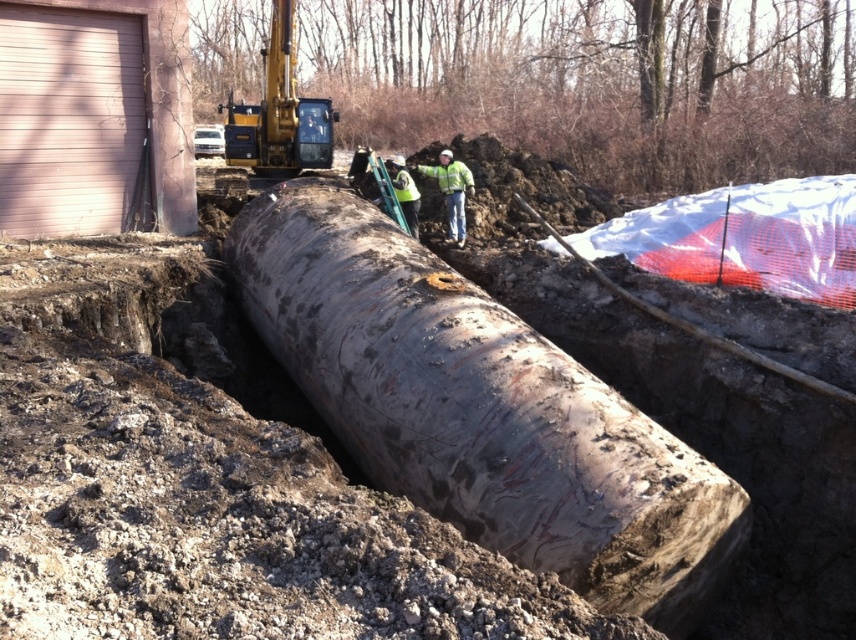
You are a construction inspector who needs to assess the installation of the rusty metallic water pipe at center. The high visibility yellow jacket at center is worn by a worker nearby. Since the jacket is meant to be seen from a distance, could the size of the jacket be an issue when viewed from the excavator parked at the edge of the trench?

The rusty metallic water pipe at center has a larger size compared to the high visibility yellow jacket at center. Since the jacket is smaller, it might be harder to see from a distance, potentially making the worker less visible to someone operating the excavator at the edge of the trench.

You are a safety inspector at the construction site. You need to check the distance between the yellow metallic excavator at upper center and the green reflective vest at center. Which object is closer to you?

The yellow metallic excavator at upper center is closer to you because it is further to the viewer than the green reflective vest at center, meaning it appears nearer in the image.

You are a safety inspector at the construction site. You notice the rusty metallic water pipe at center and the high visibility yellow jacket at center. Based on their sizes, which object would be more challenging to cover with a standard 1 meter tall safety barrier?

The rusty metallic water pipe at center is much taller than the high visibility yellow jacket at center, so it would be more challenging to cover with a standard 1 meter tall safety barrier.